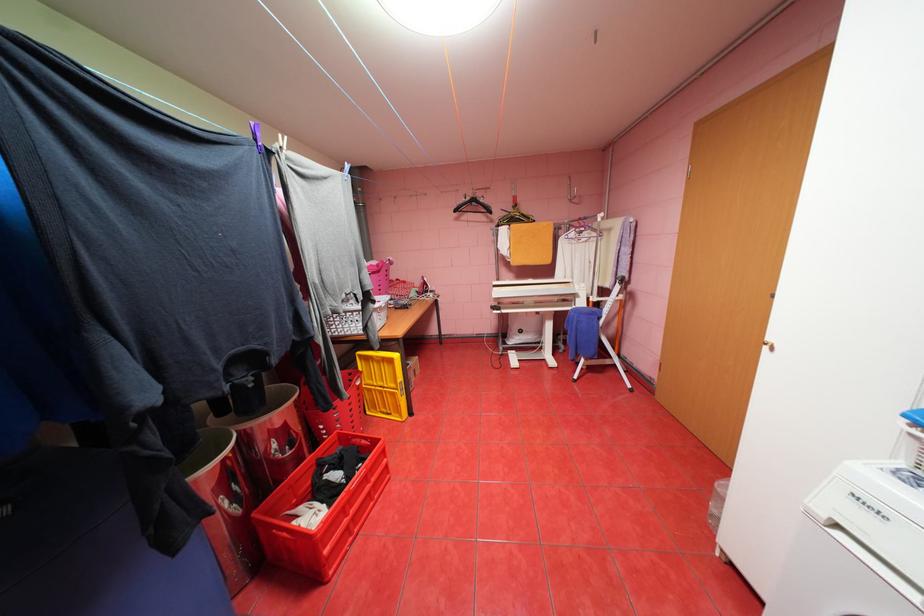
Where would you pull the brown door handle? Please return your answer as a coordinate pair (x, y).

(776, 349)